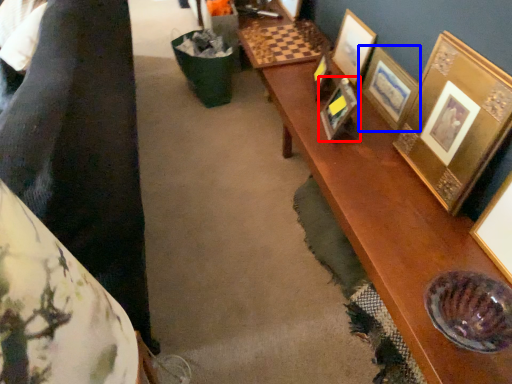
Question: Which of the following is the farthest to the observer, picture frame (highlighted by a red box) or picture frame (highlighted by a blue box)?

Choices:
 (A) picture frame
 (B) picture frame

Answer: (A)